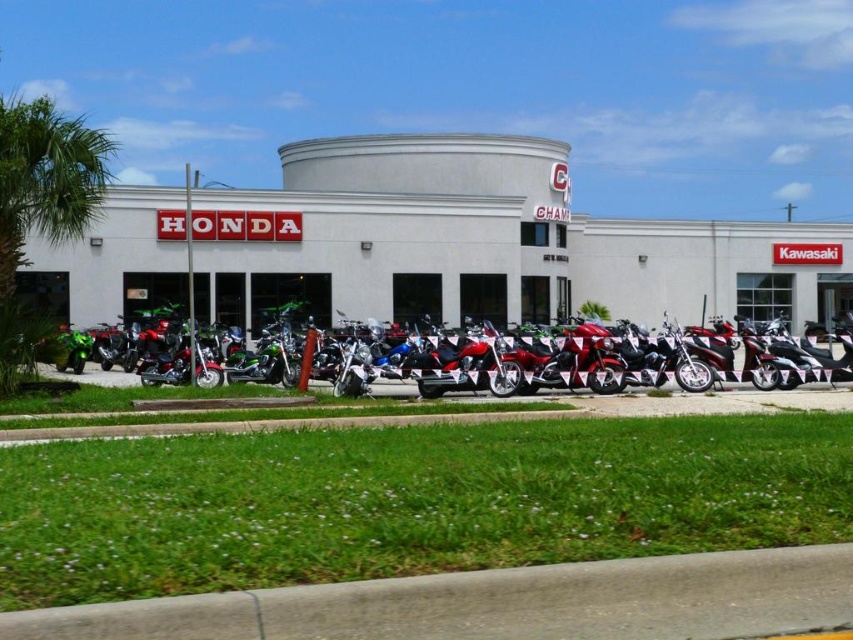
Question: Is green leafy palm tree at left positioned behind green matte motorcycle at center?

Choices:
 (A) yes
 (B) no

Answer: (B)

Question: Which of these objects is positioned farthest from the green matte motorcycle at center?

Choices:
 (A) green leafy palm tree at left
 (B) shiny chrome motorcycle at center

Answer: (A)

Question: Does green leafy palm tree at left have a smaller size compared to shiny chrome motorcycle at center?

Choices:
 (A) yes
 (B) no

Answer: (B)

Question: Which of the following is the closest to the observer?

Choices:
 (A) (689, 288)
 (B) (9, 278)
 (C) (459, 384)

Answer: (B)

Question: Is green leafy palm tree at left below shiny chrome motorcycle at center?

Choices:
 (A) yes
 (B) no

Answer: (B)

Question: Among these points, which one is nearest to the camera?

Choices:
 (A) (567, 172)
 (B) (80, 125)

Answer: (B)